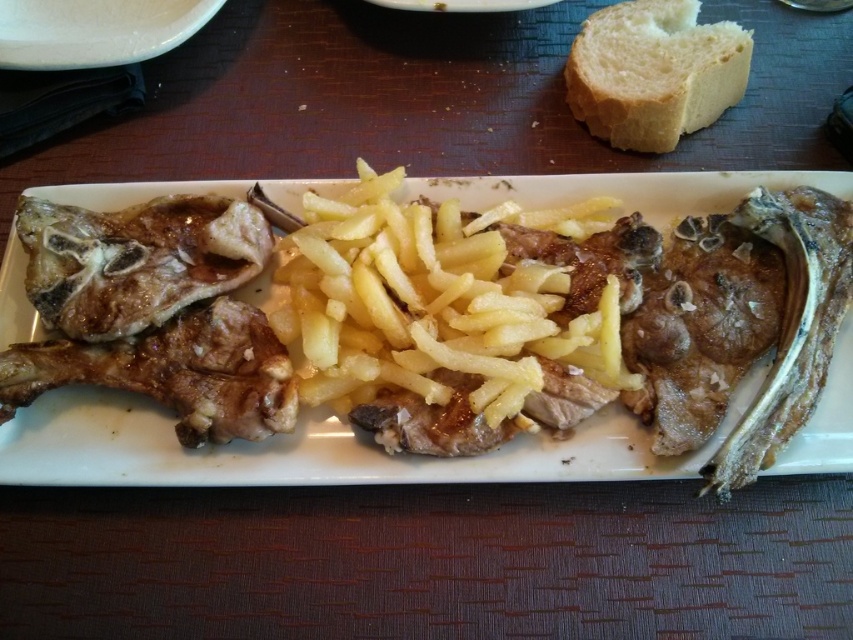
You are a food critic evaluating this meal. You want to take a bite of the golden brown crispy fries at center and the white soft bread at upper right. Which item is closer to your hand if you reach straight ahead without moving your arm?

The golden brown crispy fries at center is positioned under the white soft bread at upper right, so if you reach straight ahead without moving your arm, the golden brown crispy fries at center is closer to your hand.

Consider the image. You are a food critic evaluating this meal. You need to describe the spatial arrangement of the golden brown crispy fries at center and the white soft bread at upper right. Which object is located to the left of the other?

The golden brown crispy fries at center is positioned on the left side of white soft bread at upper right.